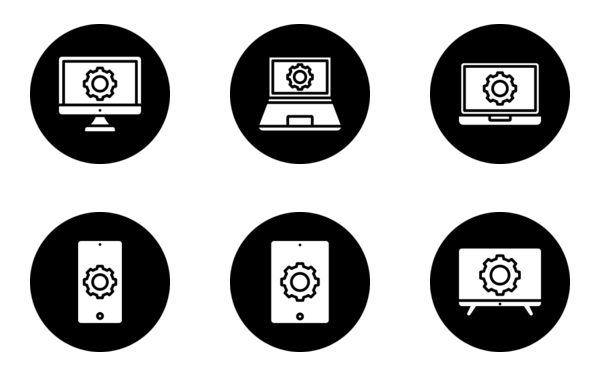
Locate an element on the screen. The image size is (600, 376). electronics is located at coordinates (130, 101), (284, 100), (473, 107), (474, 275), (289, 259), (106, 256).